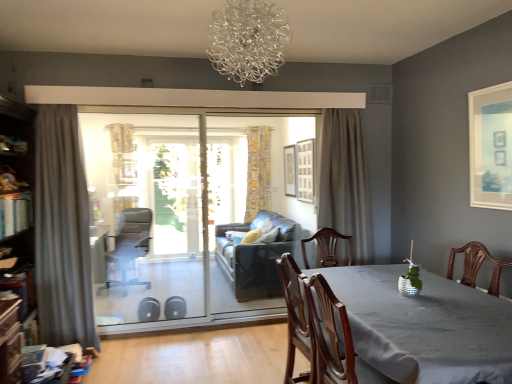
Question: From a real-world perspective, is transparent glass screen door at center located beneath matte white picture frame at upper right, the 3th picture frame positioned from the back?

Choices:
 (A) yes
 (B) no

Answer: (A)

Question: Can you confirm if transparent glass screen door at center is bigger than matte white picture frame at upper right, the first picture frame when ordered from front to back?

Choices:
 (A) yes
 (B) no

Answer: (A)

Question: Considering the relative positions of transparent glass screen door at center and matte white picture frame at upper right, the first picture frame when ordered from front to back, in the image provided, is transparent glass screen door at center to the right of matte white picture frame at upper right, the first picture frame when ordered from front to back, from the viewer's perspective?

Choices:
 (A) no
 (B) yes

Answer: (A)

Question: Considering the relative sizes of transparent glass screen door at center and matte white picture frame at upper right, arranged as the 3th picture frame when viewed from the left, in the image provided, is transparent glass screen door at center thinner than matte white picture frame at upper right, arranged as the 3th picture frame when viewed from the left,?

Choices:
 (A) no
 (B) yes

Answer: (A)

Question: Can you confirm if transparent glass screen door at center is smaller than matte white picture frame at upper right, the 3th picture frame positioned from the back?

Choices:
 (A) no
 (B) yes

Answer: (A)

Question: Considering the relative sizes of transparent glass screen door at center and matte white picture frame at upper right, arranged as the 3th picture frame when viewed from the left, in the image provided, is transparent glass screen door at center shorter than matte white picture frame at upper right, arranged as the 3th picture frame when viewed from the left,?

Choices:
 (A) yes
 (B) no

Answer: (B)

Question: Is wooden chair at center oriented away from matte white picture frame at center, which is counted as the 1th picture frame, starting from the left?

Choices:
 (A) yes
 (B) no

Answer: (B)

Question: Can you confirm if wooden chair at center is bigger than matte white picture frame at center, positioned as the third picture frame in front-to-back order?

Choices:
 (A) no
 (B) yes

Answer: (B)

Question: Is wooden chair at center outside of matte white picture frame at center, the first picture frame positioned from the back?

Choices:
 (A) yes
 (B) no

Answer: (A)

Question: Considering the relative sizes of wooden chair at center and matte white picture frame at center, arranged as the 3th picture frame when viewed from the right, in the image provided, is wooden chair at center smaller than matte white picture frame at center, arranged as the 3th picture frame when viewed from the right,?

Choices:
 (A) yes
 (B) no

Answer: (B)

Question: From the image's perspective, does wooden chair at center appear higher than matte white picture frame at center, positioned as the third picture frame in front-to-back order?

Choices:
 (A) no
 (B) yes

Answer: (A)

Question: From a real-world perspective, is wooden chair at center physically below matte white picture frame at center, arranged as the 3th picture frame when viewed from the right?

Choices:
 (A) no
 (B) yes

Answer: (B)

Question: From the image's perspective, is leather swivel chair at left above transparent glass screen door at center?

Choices:
 (A) yes
 (B) no

Answer: (B)